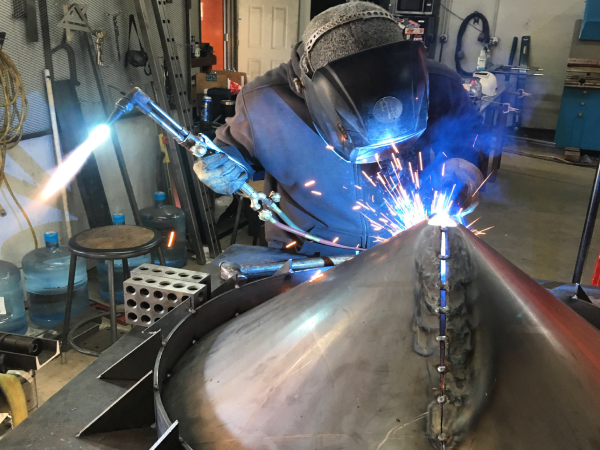
Identify the location of stool. This screenshot has height=450, width=600. (114, 235).